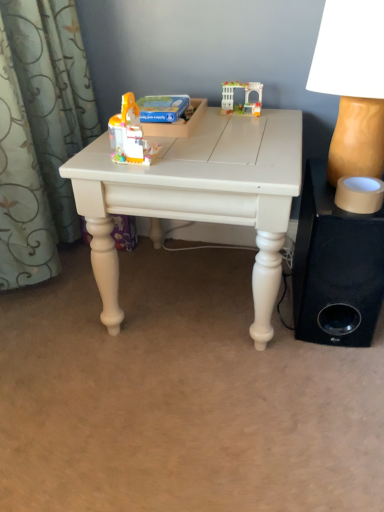
In order to click on free point to the right of translucent plastic toy at center, which is counted as the 2th toy, starting from the top in this screenshot , I will do `click(203, 154)`.